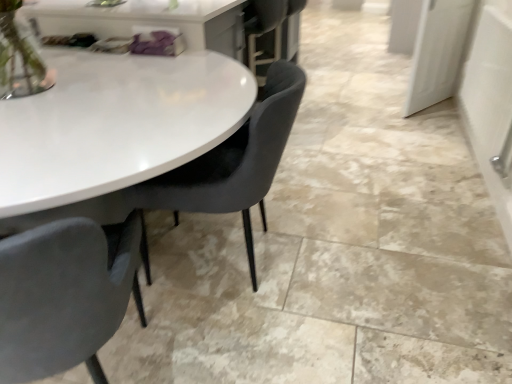
Locate an element on the screen. free point below matte black chair at center, placed as the first chair when sorted from right to left (from a real-world perspective) is located at coordinates (229, 261).